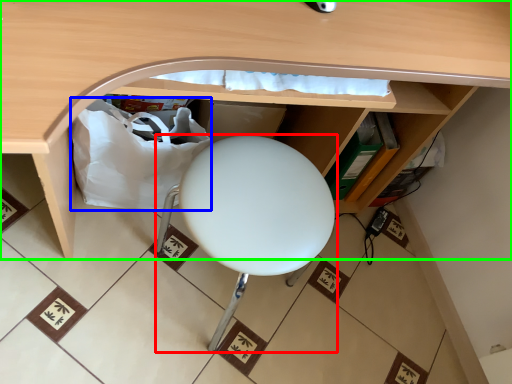
Question: Which object is positioned farthest from furniture (highlighted by a red box)? Select from paper bag (highlighted by a blue box) and desk (highlighted by a green box).

Choices:
 (A) paper bag
 (B) desk

Answer: (B)